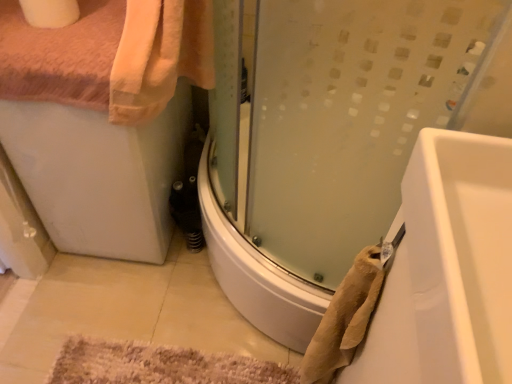
Question: From a real-world perspective, is white glossy bathtub at lower right over white matte toilet paper at upper left?

Choices:
 (A) yes
 (B) no

Answer: (B)

Question: Is white glossy bathtub at lower right to the right of white matte toilet paper at upper left from the viewer's perspective?

Choices:
 (A) yes
 (B) no

Answer: (A)

Question: Is white glossy bathtub at lower right facing towards white matte toilet paper at upper left?

Choices:
 (A) yes
 (B) no

Answer: (B)

Question: Is white glossy bathtub at lower right located outside white matte toilet paper at upper left?

Choices:
 (A) yes
 (B) no

Answer: (A)

Question: From the image's perspective, is white glossy bathtub at lower right on white matte toilet paper at upper left?

Choices:
 (A) no
 (B) yes

Answer: (A)

Question: Is white glossy bathtub at lower right not close to white matte toilet paper at upper left?

Choices:
 (A) no
 (B) yes

Answer: (A)

Question: Does white glossy bathtub at lower right touch beige textured towel at lower right?

Choices:
 (A) no
 (B) yes

Answer: (A)

Question: From a real-world perspective, is white glossy bathtub at lower right physically above beige textured towel at lower right?

Choices:
 (A) yes
 (B) no

Answer: (B)

Question: Considering the relative sizes of white glossy bathtub at lower right and beige textured towel at lower right in the image provided, is white glossy bathtub at lower right thinner than beige textured towel at lower right?

Choices:
 (A) no
 (B) yes

Answer: (A)

Question: Are white glossy bathtub at lower right and beige textured towel at lower right far apart?

Choices:
 (A) no
 (B) yes

Answer: (A)

Question: Is white glossy bathtub at lower right not within beige textured towel at lower right?

Choices:
 (A) no
 (B) yes

Answer: (B)

Question: From the image's perspective, is white glossy bathtub at lower right located beneath beige textured towel at lower right?

Choices:
 (A) yes
 (B) no

Answer: (A)

Question: From a real-world perspective, is beige textured bath mat at lower center located beneath white matte toilet paper at upper left?

Choices:
 (A) no
 (B) yes

Answer: (B)